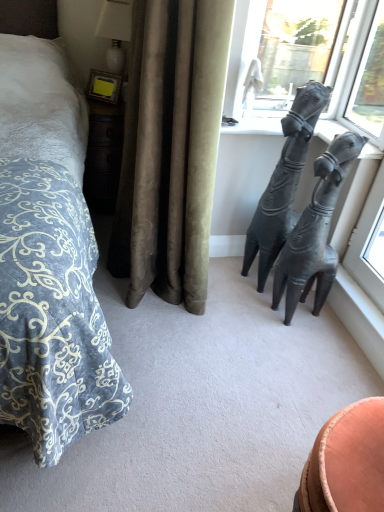
Image resolution: width=384 pixels, height=512 pixels. What are the coordinates of `free space that is to the left of black matte hand sculpture at upper right, the second statue (sculpture) positioned from the left` in the screenshot? It's located at (247, 313).